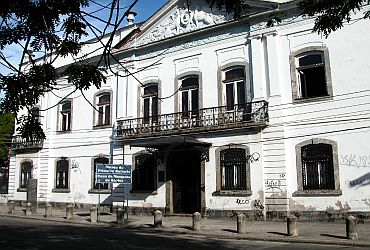
This screenshot has width=370, height=250. Identify the location of 2 windows on lower left side. [335, 168], [230, 175].